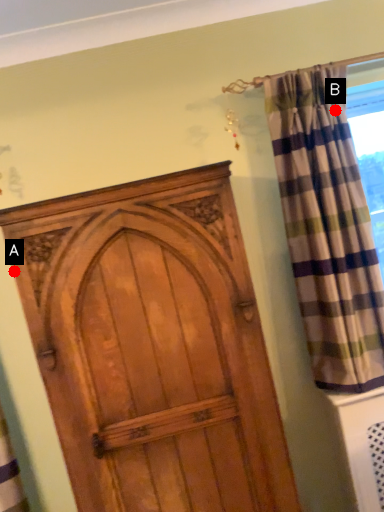
Question: Two points are circled on the image, labeled by A and B beside each circle. Among these points, which one is nearest to the camera?

Choices:
 (A) A is closer
 (B) B is closer

Answer: (A)